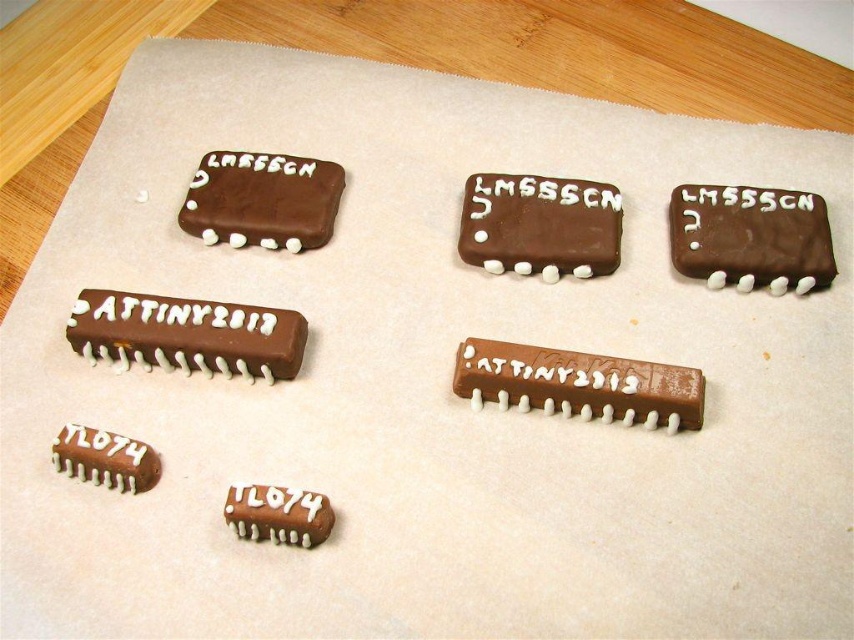
You are a baker who wants to place a new cookie between the matte chocolate chip at lower left and the chocolatesmoothintegrated circuit at upper right. The new cookie has a diameter of 3 inches. Is there enough space between them to fit the new cookie?

The distance between the matte chocolate chip at lower left and the chocolatesmoothintegrated circuit at upper right is 27.37 inches. Since the new cookie has a diameter of 3 inches, there is sufficient space to place it between them.

You are a baker who wants to stack the chocolatesmoothattiny2312 at center and the matte brown chip at bottom left on top of each other. Which one should you place at the bottom to ensure stability?

The chocolatesmoothattiny2312 at center is taller than the matte brown chip at bottom left, so to ensure stability, place the taller chocolatesmoothattiny2312 at center at the bottom.

You are a baker who just finished making these IC cookies. You want to place a small chocolate sprinkle between the matte chocolate chip at lower left and the matte chocolate chip at lower center. Can you do that without moving either of the existing chips?

The matte chocolate chip at lower center is behind the matte chocolate chip at lower left, so there is no space between them for the sprinkle. You cannot place the sprinkle without moving one of the chips.